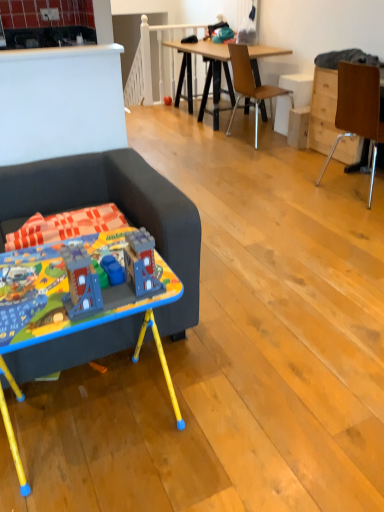
At what (x,y) coordinates should I click in order to perform the action: click on vacant space situated on the left part of wooden chair at right, the second chair positioned from the back. Please return your answer as a coordinate pair (x, y). This screenshot has width=384, height=512. Looking at the image, I should click on (289, 192).